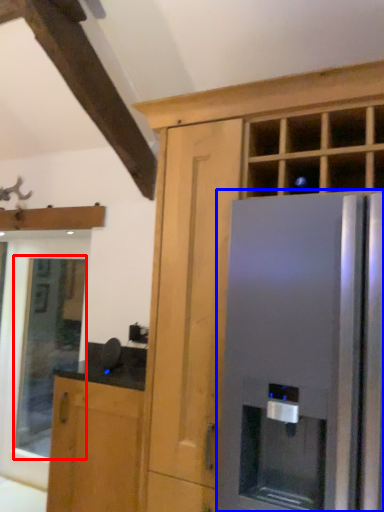
Question: Which object is closer to the camera taking this photo, window (highlighted by a red box) or refrigerator (highlighted by a blue box)?

Choices:
 (A) window
 (B) refrigerator

Answer: (B)